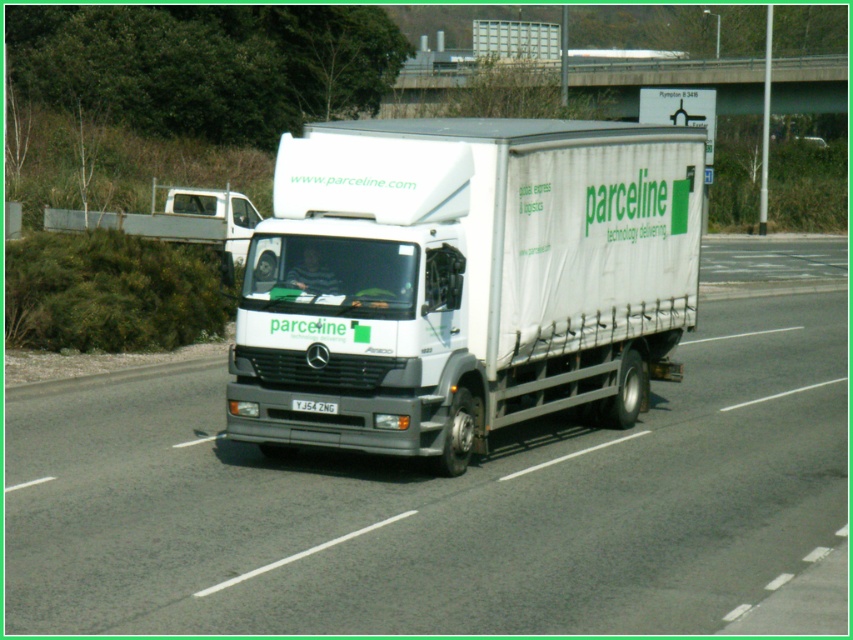
Between white matte truck at center and white plastic license plate at center, which one has more height?

white matte truck at center is taller.

Which of these two, white matte truck at center or white plastic license plate at center, stands shorter?

With less height is white plastic license plate at center.

Which is in front, point (299, 340) or point (334, 403)?

Point (299, 340)

Image resolution: width=853 pixels, height=640 pixels. Identify the location of white matte truck at center. (463, 280).

Which is more to the right, white glossy truck at center or white plastic license plate at center?

From the viewer's perspective, white glossy truck at center appears more on the right side.

From the picture: Can you confirm if white glossy truck at center is shorter than white plastic license plate at center?

No, white glossy truck at center is not shorter than white plastic license plate at center.

Is point (683, 484) positioned before point (296, 404)?

No, (683, 484) is behind (296, 404).

Find the location of `white glossy truck at center`. white glossy truck at center is located at coordinates (450, 493).

Locate an element on the screen. Image resolution: width=853 pixels, height=640 pixels. white glossy truck at center is located at coordinates (450, 493).

Is white glossy truck at center positioned in front of white matte truck at center?

Yes, it is.

Between point (706, 564) and point (474, 273), which one is positioned behind?

The point (474, 273) is more distant.

Locate an element on the screen. Image resolution: width=853 pixels, height=640 pixels. white glossy truck at center is located at coordinates (450, 493).